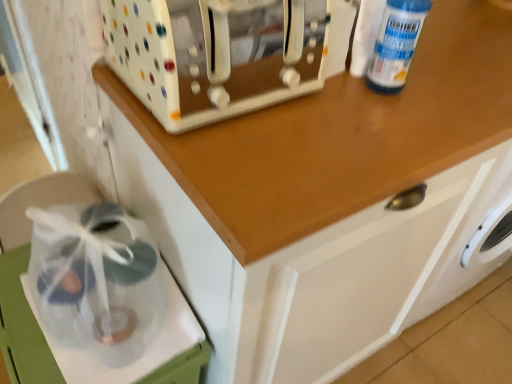
Where is `vacant space underneath white glossy toaster at upper center (from a real-world perspective)`? The image size is (512, 384). vacant space underneath white glossy toaster at upper center (from a real-world perspective) is located at coordinates (237, 87).